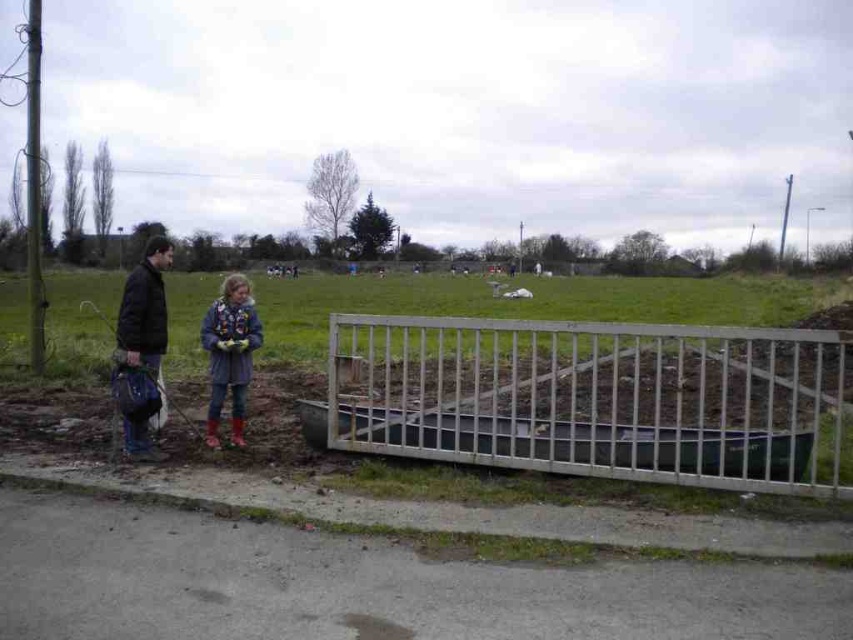
Question: Among these points, which one is nearest to the camera?

Choices:
 (A) (245, 371)
 (B) (138, 291)

Answer: (B)

Question: Which point is farther to the camera?

Choices:
 (A) tap(138, 294)
 (B) tap(396, 451)

Answer: (A)

Question: Can you confirm if silver metallic fence at center is thinner than denim jacket at center?

Choices:
 (A) no
 (B) yes

Answer: (A)

Question: Is dark brown leather jacket at left further to camera compared to denim jacket at center?

Choices:
 (A) no
 (B) yes

Answer: (A)

Question: Which object is positioned farthest from the silver metallic fence at center?

Choices:
 (A) denim jacket at center
 (B) dark brown leather jacket at left

Answer: (B)

Question: Can you confirm if dark brown leather jacket at left is positioned to the left of denim jacket at center?

Choices:
 (A) yes
 (B) no

Answer: (A)